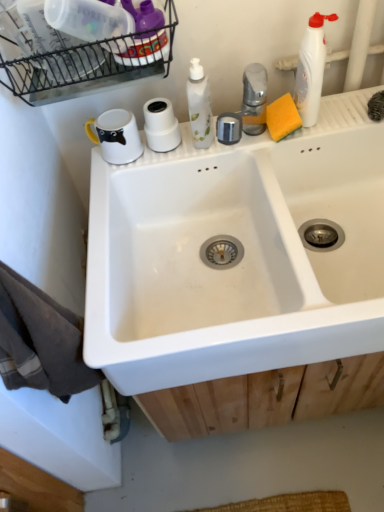
What do you see at coordinates (282, 117) in the screenshot?
I see `yellow sponge at upper right` at bounding box center [282, 117].

What is the approximate width of white matte toilet paper at upper center?

white matte toilet paper at upper center is 3.16 inches wide.

The image size is (384, 512). Find the location of `white ceramic sink at center`. white ceramic sink at center is located at coordinates (244, 254).

The image size is (384, 512). In order to click on black wire basket at upper left in this screenshot , I will do `click(79, 59)`.

This screenshot has height=512, width=384. What do you see at coordinates (311, 69) in the screenshot? I see `white plastic bottle at upper right` at bounding box center [311, 69].

Where is `yellow sponge at upper right`? yellow sponge at upper right is located at coordinates (282, 117).

You are a GUI agent. You are given a task and a screenshot of the screen. Output one action in this format:
    pyautogui.click(x=<x>, y=<y>)
    Task: Click on the sink in front of the white plastic bottle at upper right
    
    Given the screenshot: What is the action you would take?
    pyautogui.click(x=244, y=254)

Is white ceramic sink at center situated inside white plastic bottle at upper right or outside?

white ceramic sink at center is located beyond the bounds of white plastic bottle at upper right.

Does white ceramic sink at center have a lesser height compared to white plastic bottle at upper right?

No, white ceramic sink at center is not shorter than white plastic bottle at upper right.

From the image's perspective, which is above, white matte toilet paper at upper center or yellow sponge at upper right?

yellow sponge at upper right.

Image resolution: width=384 pixels, height=512 pixels. What are the coordinates of `soap in front of the white matte toilet paper at upper center` in the screenshot? It's located at coord(282,117).

Is white matte toilet paper at upper center positioned with its back to yellow sponge at upper right?

No, white matte toilet paper at upper center is not facing the opposite direction of yellow sponge at upper right.

Considering the sizes of objects white matte toilet paper at upper center and yellow sponge at upper right in the image provided, who is shorter, white matte toilet paper at upper center or yellow sponge at upper right?

Standing shorter between the two is yellow sponge at upper right.

Is point (325, 54) closer to viewer compared to point (159, 143)?

No.

Is white plastic bottle at upper right at the left side of white matte toilet paper at upper center?

No, white plastic bottle at upper right is not to the left of white matte toilet paper at upper center.

Does white plastic bottle at upper right turn towards white matte toilet paper at upper center?

No.

Can you confirm if white matte toilet paper at upper center is thinner than black wire basket at upper left?

Yes, white matte toilet paper at upper center is thinner than black wire basket at upper left.

From a real-world perspective, is white matte toilet paper at upper center on top of black wire basket at upper left?

No, from a real-world perspective, white matte toilet paper at upper center is not on top of black wire basket at upper left.

What's the angular difference between white matte toilet paper at upper center and black wire basket at upper left's facing directions?

There is a 1.11-degree angle between the facing directions of white matte toilet paper at upper center and black wire basket at upper left.

From the image's perspective, is white matte toilet paper at upper center over black wire basket at upper left?

No.

Is white plastic bottle at upper right oriented away from yellow sponge at upper right?

No, yellow sponge at upper right is not at the back of white plastic bottle at upper right.

Considering the positions of objects white plastic bottle at upper right and yellow sponge at upper right in the image provided, who is in front, white plastic bottle at upper right or yellow sponge at upper right?

white plastic bottle at upper right is in front.

From a real-world perspective, who is located higher, white plastic bottle at upper right or yellow sponge at upper right?

white plastic bottle at upper right.

Locate an element on the screen. cleaning product located above the yellow sponge at upper right (from a real-world perspective) is located at coordinates (311, 69).

Considering the points (306, 46) and (136, 197), which point is in front, point (306, 46) or point (136, 197)?

Point (306, 46)

Can you confirm if white plastic bottle at upper right is positioned to the left of white ceramic sink at center?

No, white plastic bottle at upper right is not to the left of white ceramic sink at center.

From a real-world perspective, is white plastic bottle at upper right physically located above or below white ceramic sink at center?

Clearly, from a real-world perspective, white plastic bottle at upper right is above white ceramic sink at center.

Identify the location of soap that appears behind the white ceramic sink at center. (282, 117).

Considering the sizes of objects yellow sponge at upper right and white ceramic sink at center in the image provided, who is thinner, yellow sponge at upper right or white ceramic sink at center?

yellow sponge at upper right.

Which object is further away from the camera taking this photo, yellow sponge at upper right or white ceramic sink at center?

yellow sponge at upper right.

Is yellow sponge at upper right far away from white ceramic sink at center?

yellow sponge at upper right is actually quite close to white ceramic sink at center.

Locate an element on the screen. cleaning product positioned vertically above the white ceramic sink at center (from a real-world perspective) is located at coordinates (311, 69).

Locate an element on the screen. soap that is above the white matte toilet paper at upper center (from the image's perspective) is located at coordinates (282, 117).

When comparing their distances from white matte toilet paper at upper center, does white plastic bottle at upper right or black wire basket at upper left seem further?

The object further to white matte toilet paper at upper center is white plastic bottle at upper right.

From the image, which object appears to be farther from black wire basket at upper left, white plastic bottle at upper right or white ceramic sink at center?

white plastic bottle at upper right is further to black wire basket at upper left.

From the image, which object appears to be nearer to yellow sponge at upper right, white matte toilet paper at upper center or white ceramic sink at center?

Among the two, white matte toilet paper at upper center is located nearer to yellow sponge at upper right.

Consider the image. From the image, which object appears to be farther from white ceramic sink at center, white plastic bottle at upper right or white matte toilet paper at upper center?

white plastic bottle at upper right is further to white ceramic sink at center.

When comparing their distances from yellow sponge at upper right, does white matte toilet paper at upper center or white plastic bottle at upper right seem closer?

white plastic bottle at upper right is positioned closer to the anchor yellow sponge at upper right.

Based on the photo, considering their positions, is white ceramic sink at center positioned closer to white matte toilet paper at upper center than yellow sponge at upper right?

yellow sponge at upper right lies closer to white matte toilet paper at upper center than the other object.

Based on their spatial positions, is black wire basket at upper left or white plastic bottle at upper right further from white matte toilet paper at upper center?

white plastic bottle at upper right.

Looking at the image, which one is located closer to yellow sponge at upper right, white plastic bottle at upper right or black wire basket at upper left?

white plastic bottle at upper right is closer to yellow sponge at upper right.

The width and height of the screenshot is (384, 512). I want to click on sink between black wire basket at upper left and white plastic bottle at upper right, so click(x=244, y=254).

Identify the location of soap that lies between white plastic bottle at upper right and white ceramic sink at center from top to bottom. (282, 117).

You are a GUI agent. You are given a task and a screenshot of the screen. Output one action in this format:
    pyautogui.click(x=<x>, y=<y>)
    Task: Click on the toilet paper located between black wire basket at upper left and white ceramic sink at center in the left-right direction
    
    Given the screenshot: What is the action you would take?
    pyautogui.click(x=161, y=125)

Locate an element on the screen. toilet paper between black wire basket at upper left and yellow sponge at upper right in the horizontal direction is located at coordinates point(161,125).